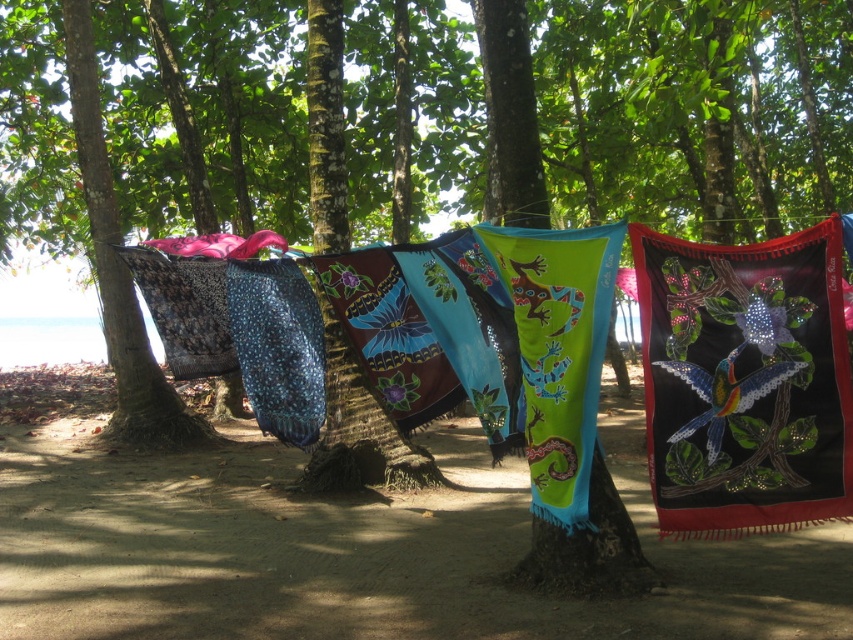
You are standing at the origin point of the coordinate system. You want to move towards the textured fabric beach towels at center. What direction should you move in?

The textured fabric beach towels at center are located at coordinate point 0.861 on the x axis and 0.423 on the y axis. Since you are at the origin point, you should move towards the positive x and positive y direction to reach them.

You are at the beach and see the textured fabric beach towels at center and the black sequined cloth at center. Which one is positioned to the left?

The textured fabric beach towels at center are positioned to the left of the black sequined cloth at center.